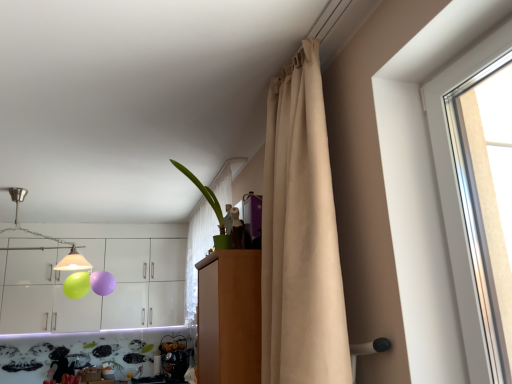
Question: From a real-world perspective, is white glossy cabinets at upper left below brushed metal lampshade at upper left?

Choices:
 (A) yes
 (B) no

Answer: (A)

Question: Is white glossy cabinets at upper left placed right next to brushed metal lampshade at upper left?

Choices:
 (A) no
 (B) yes

Answer: (A)

Question: Is white glossy cabinets at upper left wider than brushed metal lampshade at upper left?

Choices:
 (A) no
 (B) yes

Answer: (A)

Question: Is white glossy cabinets at upper left outside brushed metal lampshade at upper left?

Choices:
 (A) yes
 (B) no

Answer: (A)

Question: Is white glossy cabinets at upper left taller than brushed metal lampshade at upper left?

Choices:
 (A) yes
 (B) no

Answer: (A)

Question: From the image's perspective, is white glossy cabinets at upper left positioned above or below green matte plant at upper center?

Choices:
 (A) above
 (B) below

Answer: (B)

Question: Considering the positions of point (120, 309) and point (217, 206), is point (120, 309) closer or farther from the camera than point (217, 206)?

Choices:
 (A) farther
 (B) closer

Answer: (A)

Question: In terms of height, does white glossy cabinets at upper left look taller or shorter compared to green matte plant at upper center?

Choices:
 (A) tall
 (B) short

Answer: (A)

Question: From a real-world perspective, relative to green matte plant at upper center, is white glossy cabinets at upper left vertically above or below?

Choices:
 (A) above
 (B) below

Answer: (B)

Question: Do you think white glossy cabinets at upper left is within beige fabric curtain at upper right, or outside of it?

Choices:
 (A) inside
 (B) outside

Answer: (B)

Question: Relative to beige fabric curtain at upper right, is white glossy cabinets at upper left in front or behind?

Choices:
 (A) front
 (B) behind

Answer: (B)

Question: Looking at the image, does white glossy cabinets at upper left seem bigger or smaller compared to beige fabric curtain at upper right?

Choices:
 (A) small
 (B) big

Answer: (B)

Question: Based on their positions, is white glossy cabinets at upper left located to the left or right of beige fabric curtain at upper right?

Choices:
 (A) right
 (B) left

Answer: (B)

Question: Considering the positions of point (330, 370) and point (11, 228), is point (330, 370) closer or farther from the camera than point (11, 228)?

Choices:
 (A) farther
 (B) closer

Answer: (B)

Question: From their relative heights in the image, would you say beige fabric curtain at upper right is taller or shorter than brushed metal lampshade at upper left?

Choices:
 (A) tall
 (B) short

Answer: (A)